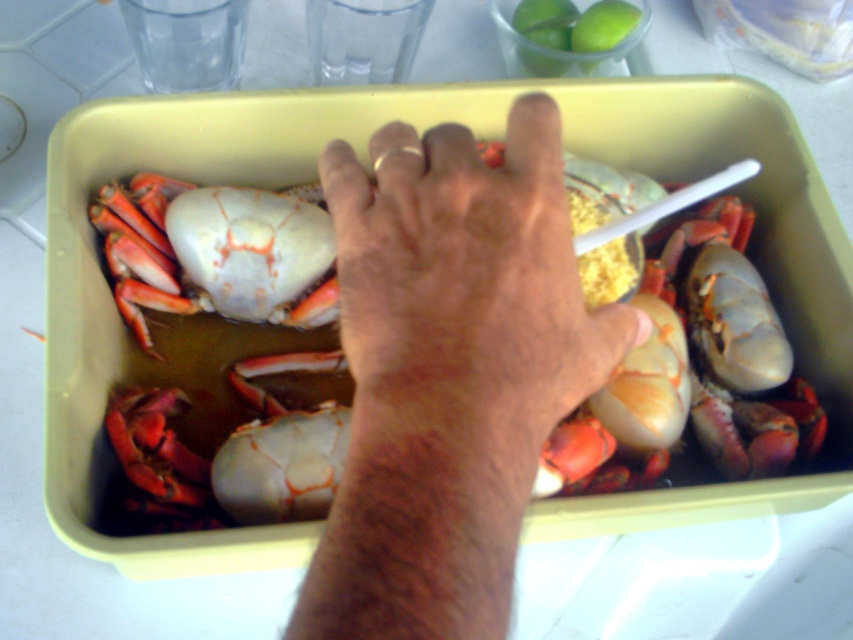
You are a food safety inspector checking the crab container. You notice a point at coordinates (450, 372). Based on the scene, what is this point likely indicating?

The point at coordinates (450, 372) is on dry skin hand at center, which suggests that the hand is not submerged in the liquid inside the crab container.

From the picture: You are a food safety inspector checking the crab container. You see the dry skin hand at center. Where is the dry skin hand located in relation to the crab container?

The dry skin hand at center is located at point 0.583 on the x axis and 0.528 on the y axis relative to the crab container.

You are a food safety inspector checking the crab container. You notice the dry skin hand at center and the smooth orange crab at center. Which object is closer to you?

The dry skin hand at center is closer to the viewer than the smooth orange crab at center, so the dry skin hand at center is closer to you.